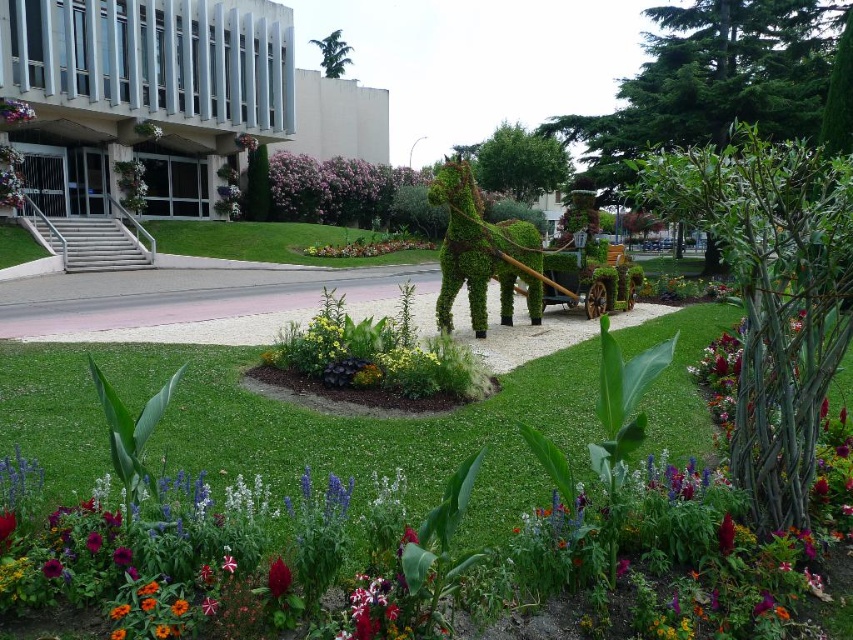
Between point (601, 260) and point (45, 566), which one is positioned in front?

Point (45, 566) is in front.

This screenshot has height=640, width=853. I want to click on green leafy material wagon at center, so click(x=581, y=273).

Between vivid red petal at lower left and vivid red petal at center, which one appears on the left side from the viewer's perspective?

vivid red petal at lower left is more to the left.

Does vivid red petal at lower left have a lesser width compared to vivid red petal at center?

In fact, vivid red petal at lower left might be wider than vivid red petal at center.

Image resolution: width=853 pixels, height=640 pixels. Describe the element at coordinates (51, 568) in the screenshot. I see `vivid red petal at lower left` at that location.

Image resolution: width=853 pixels, height=640 pixels. What are the coordinates of `vivid red petal at lower left` in the screenshot? It's located at (51, 568).

Does green leafy material wagon at center appear on the right side of vivid crimson petal at lower center?

Yes, green leafy material wagon at center is to the right of vivid crimson petal at lower center.

Is point (521, 266) closer to camera compared to point (283, 577)?

No, (521, 266) is behind (283, 577).

Find the location of `green leafy material wagon at center`. green leafy material wagon at center is located at coordinates (581, 273).